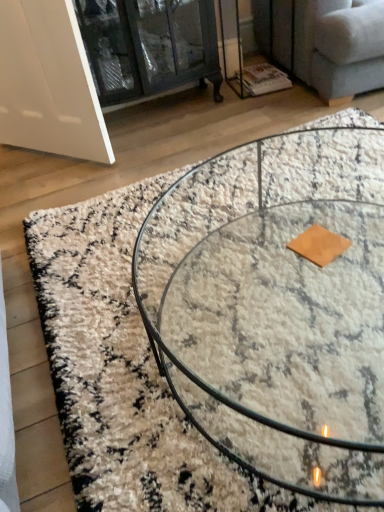
Question: From a real-world perspective, does light gray fabric couch at upper right stand above clear glass coffee table at center?

Choices:
 (A) no
 (B) yes

Answer: (B)

Question: Can you confirm if light gray fabric couch at upper right is wider than clear glass coffee table at center?

Choices:
 (A) yes
 (B) no

Answer: (A)

Question: Is the depth of light gray fabric couch at upper right greater than that of clear glass coffee table at center?

Choices:
 (A) no
 (B) yes

Answer: (B)

Question: From the image's perspective, is light gray fabric couch at upper right above clear glass coffee table at center?

Choices:
 (A) yes
 (B) no

Answer: (A)

Question: Considering the relative sizes of light gray fabric couch at upper right and clear glass coffee table at center in the image provided, is light gray fabric couch at upper right shorter than clear glass coffee table at center?

Choices:
 (A) no
 (B) yes

Answer: (A)

Question: Relative to light gray fabric couch at upper right, is clear glass cabinet at upper left in front or behind?

Choices:
 (A) front
 (B) behind

Answer: (B)

Question: From their relative heights in the image, would you say clear glass cabinet at upper left is taller or shorter than light gray fabric couch at upper right?

Choices:
 (A) short
 (B) tall

Answer: (B)

Question: Does point (185, 36) appear closer or farther from the camera than point (276, 15)?

Choices:
 (A) closer
 (B) farther

Answer: (A)

Question: Considering the positions of clear glass cabinet at upper left and light gray fabric couch at upper right in the image, is clear glass cabinet at upper left wider or thinner than light gray fabric couch at upper right?

Choices:
 (A) wide
 (B) thin

Answer: (B)

Question: In terms of height, does clear glass coffee table at center look taller or shorter compared to clear glass cabinet at upper left?

Choices:
 (A) tall
 (B) short

Answer: (B)

Question: From a real-world perspective, is clear glass coffee table at center physically located above or below clear glass cabinet at upper left?

Choices:
 (A) above
 (B) below

Answer: (B)

Question: Relative to clear glass cabinet at upper left, is clear glass coffee table at center in front or behind?

Choices:
 (A) front
 (B) behind

Answer: (A)

Question: Do you think clear glass coffee table at center is within clear glass cabinet at upper left, or outside of it?

Choices:
 (A) outside
 (B) inside

Answer: (A)

Question: Considering the positions of clear glass cabinet at upper left and clear glass coffee table at center in the image, is clear glass cabinet at upper left bigger or smaller than clear glass coffee table at center?

Choices:
 (A) small
 (B) big

Answer: (A)

Question: From the image's perspective, relative to clear glass coffee table at center, is clear glass cabinet at upper left above or below?

Choices:
 (A) below
 (B) above

Answer: (B)